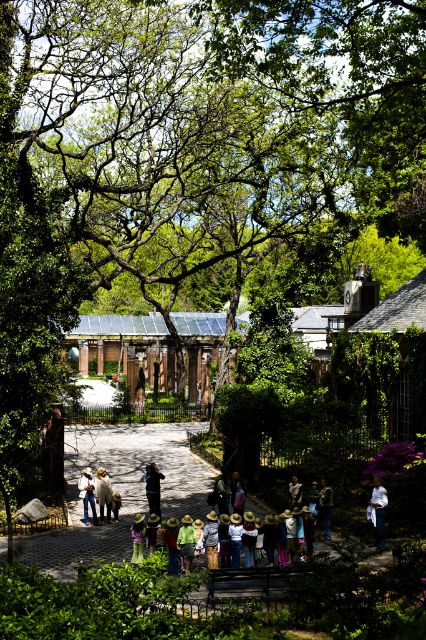
Does green straw hat at center have a greater width compared to light brown straw hat at center?

Yes, green straw hat at center is wider than light brown straw hat at center.

Based on the photo, which is more to the left, green straw hat at center or light brown straw hat at center?

green straw hat at center is more to the left.

Which is in front, point (141, 522) or point (294, 483)?

Point (141, 522) is more forward.

Where is `green straw hat at center`? Image resolution: width=426 pixels, height=640 pixels. green straw hat at center is located at coordinates (138, 538).

Is light brown leather jacket at center thinner than denim jacket at center?

Yes.

Does light brown leather jacket at center have a lesser height compared to denim jacket at center?

Yes, light brown leather jacket at center is shorter than denim jacket at center.

Which is in front, point (106, 500) or point (92, 522)?

Point (106, 500) is in front.

The height and width of the screenshot is (640, 426). Identify the location of light brown leather jacket at center. (103, 493).

Is point (377, 529) farther from viewer compared to point (83, 490)?

No, (377, 529) is closer to viewer.

Is white cotton shirt at center to the right of denim jacket at center from the viewer's perspective?

Yes, white cotton shirt at center is to the right of denim jacket at center.

You are a GUI agent. You are given a task and a screenshot of the screen. Output one action in this format:
    pyautogui.click(x=<x>, y=<y>)
    Task: Click on the white cotton shirt at center
    
    Given the screenshot: What is the action you would take?
    pyautogui.click(x=377, y=509)

At what (x,y) coordinates should I click in order to perform the action: click on white cotton shirt at center. Please return your answer as a coordinate pair (x, y). This screenshot has width=426, height=640. Looking at the image, I should click on 377,509.